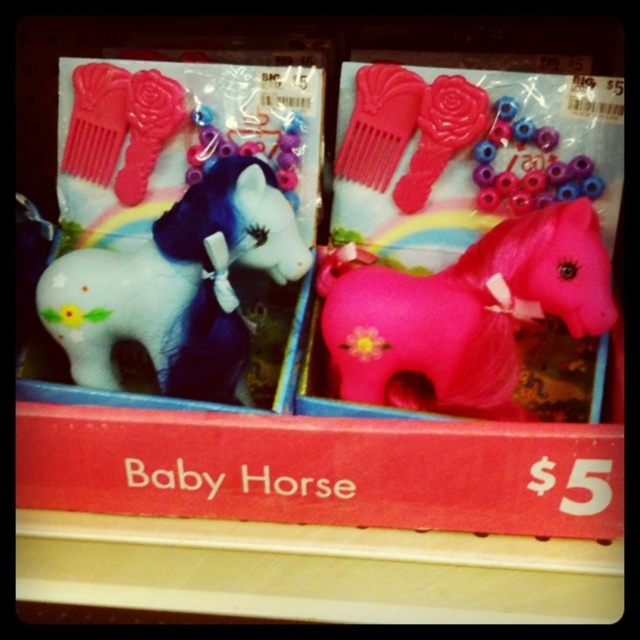
You are a customer standing in front of the two packages of toy horses. You want to know which package contains the pink matte horse at center. Can you determine this based on their positions?

The pink matte horse at center is located in the right package.

You are a customer looking at the two packages. Which horse is closer to you, the pink matte horse at center or the white matte horse at left?

The pink matte horse at center is closer to you because it is in front of the white matte horse at left.